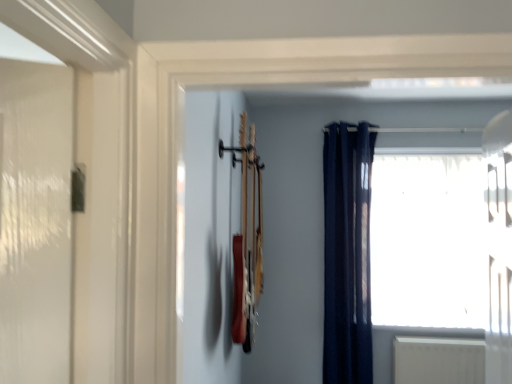
Question: Can we say navy blue fabric curtain at right lies outside transparent glass window at upper right?

Choices:
 (A) yes
 (B) no

Answer: (A)

Question: Can you confirm if navy blue fabric curtain at right is positioned to the right of transparent glass window at upper right?

Choices:
 (A) no
 (B) yes

Answer: (A)

Question: Considering the relative sizes of navy blue fabric curtain at right and transparent glass window at upper right in the image provided, is navy blue fabric curtain at right wider than transparent glass window at upper right?

Choices:
 (A) no
 (B) yes

Answer: (B)

Question: Is navy blue fabric curtain at right looking in the opposite direction of transparent glass window at upper right?

Choices:
 (A) no
 (B) yes

Answer: (A)

Question: Is the depth of navy blue fabric curtain at right greater than that of transparent glass window at upper right?

Choices:
 (A) yes
 (B) no

Answer: (B)

Question: Is transparent glass window at upper right a part of navy blue fabric curtain at right?

Choices:
 (A) no
 (B) yes

Answer: (A)

Question: Is transparent glass window at upper right looking in the opposite direction of navy blue fabric curtain at right?

Choices:
 (A) yes
 (B) no

Answer: (B)

Question: From a real-world perspective, is transparent glass window at upper right located higher than navy blue fabric curtain at right?

Choices:
 (A) yes
 (B) no

Answer: (A)

Question: Does transparent glass window at upper right have a lesser width compared to navy blue fabric curtain at right?

Choices:
 (A) no
 (B) yes

Answer: (B)

Question: Can you confirm if transparent glass window at upper right is wider than navy blue fabric curtain at right?

Choices:
 (A) yes
 (B) no

Answer: (B)

Question: From the image's perspective, is transparent glass window at upper right on top of navy blue fabric curtain at right?

Choices:
 (A) yes
 (B) no

Answer: (A)

Question: From a real-world perspective, is transparent glass window at upper right beneath navy blue fabric curtain at right?

Choices:
 (A) yes
 (B) no

Answer: (B)

Question: Is transparent glass window at upper right situated inside navy blue fabric curtain at right or outside?

Choices:
 (A) outside
 (B) inside

Answer: (A)